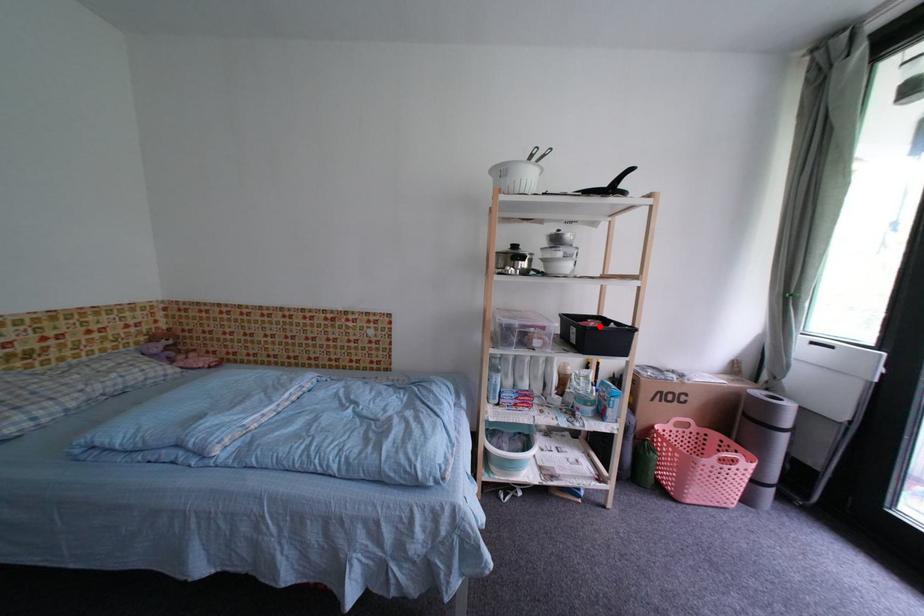
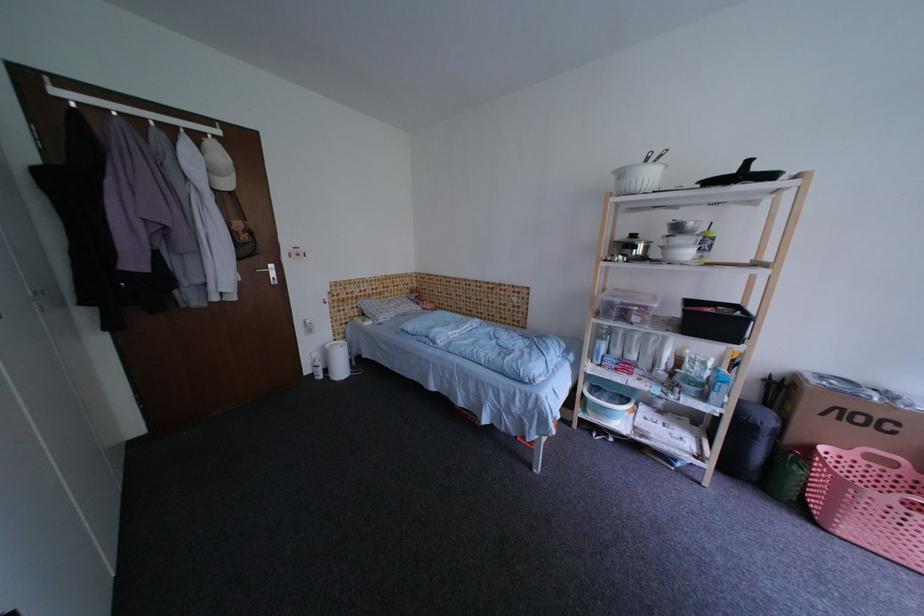
Where in the second image is the point corresponding to the highlighted location from the first image?

(716, 313)